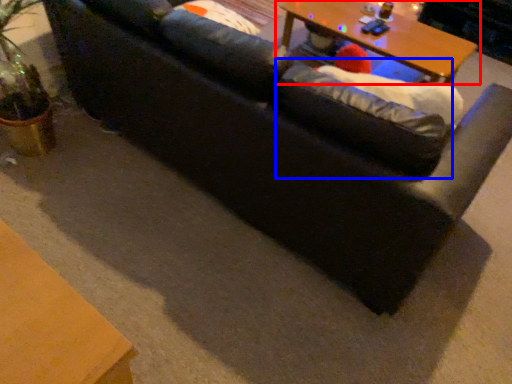
Question: Among these objects, which one is farthest to the camera, table (highlighted by a red box) or bean bag chair (highlighted by a blue box)?

Choices:
 (A) table
 (B) bean bag chair

Answer: (A)